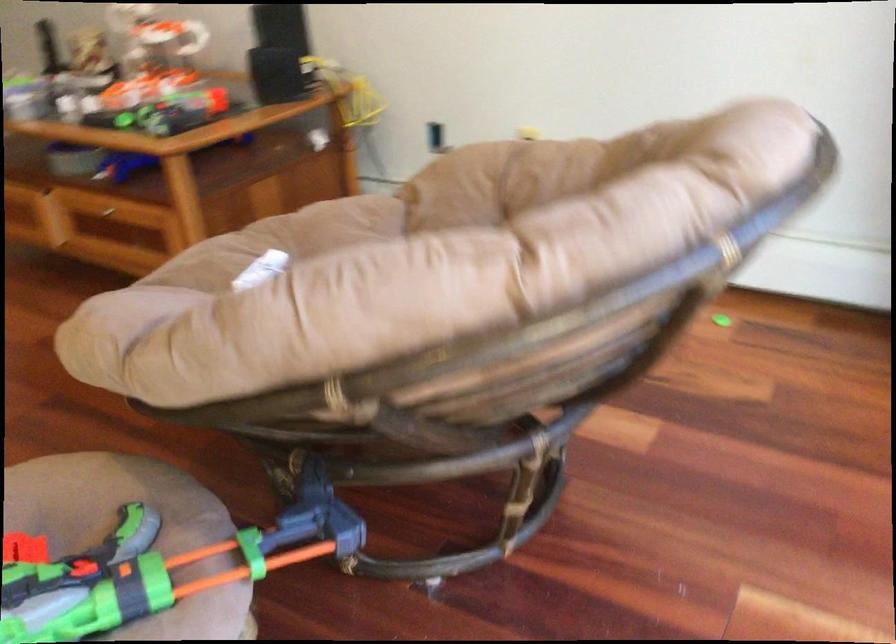
Where is `stool sitting surface`? Image resolution: width=896 pixels, height=644 pixels. stool sitting surface is located at coordinates (133, 532).